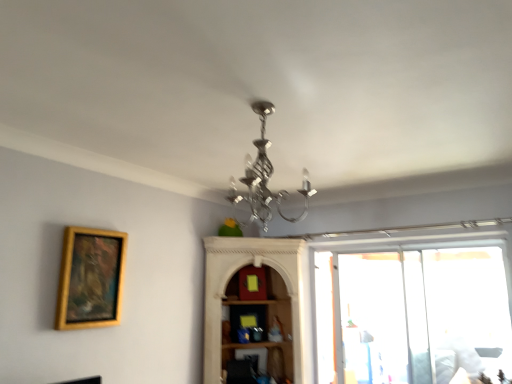
This screenshot has width=512, height=384. What do you see at coordinates (264, 178) in the screenshot?
I see `silver metallic chandelier at center` at bounding box center [264, 178].

In order to face silver metallic chandelier at center, should I rotate leftwards or rightwards?

Rotate right and turn 0.034 degrees.

What do you see at coordinates (90, 278) in the screenshot? The width and height of the screenshot is (512, 384). I see `gold wooden picture frame at left` at bounding box center [90, 278].

Identify the location of silver metallic chandelier at center. The image size is (512, 384). (264, 178).

Are transparent plastic screen door at right and silver metallic chandelier at center making contact?

No, transparent plastic screen door at right is not beside silver metallic chandelier at center.

Which is more to the right, transparent plastic screen door at right or silver metallic chandelier at center?

transparent plastic screen door at right is more to the right.

Is transparent plastic screen door at right facing towards silver metallic chandelier at center?

Yes, transparent plastic screen door at right is aimed at silver metallic chandelier at center.

Considering the sizes of gold wooden picture frame at left and transparent plastic screen door at right in the image, is gold wooden picture frame at left taller or shorter than transparent plastic screen door at right?

Clearly, gold wooden picture frame at left is shorter compared to transparent plastic screen door at right.

Is gold wooden picture frame at left turned away from transparent plastic screen door at right?

No, transparent plastic screen door at right is not at the back of gold wooden picture frame at left.

Would you say gold wooden picture frame at left is a long distance from transparent plastic screen door at right?

Yes, gold wooden picture frame at left and transparent plastic screen door at right are quite far apart.

Considering the sizes of silver metallic chandelier at center and transparent plastic screen door at right in the image, is silver metallic chandelier at center bigger or smaller than transparent plastic screen door at right?

In the image, silver metallic chandelier at center appears to be smaller than transparent plastic screen door at right.

Identify the location of screen door beneath the silver metallic chandelier at center (from a real-world perspective). (383, 318).

Based on the photo, from a real-world perspective, which object stands above the other?

From a 3D spatial view, silver metallic chandelier at center is above.

Between silver metallic chandelier at center and transparent plastic screen door at right, which one appears on the right side from the viewer's perspective?

From the viewer's perspective, transparent plastic screen door at right appears more on the right side.

Would you say silver metallic chandelier at center is outside gold wooden picture frame at left?

Yes, silver metallic chandelier at center is outside of gold wooden picture frame at left.

Does silver metallic chandelier at center come in front of gold wooden picture frame at left?

Yes, it is.

Are silver metallic chandelier at center and gold wooden picture frame at left making contact?

silver metallic chandelier at center and gold wooden picture frame at left are clearly separated.

Between silver metallic chandelier at center and gold wooden picture frame at left, which one has smaller size?

With smaller size is gold wooden picture frame at left.

Considering the relative sizes of gold wooden picture frame at left and silver metallic chandelier at center in the image provided, is gold wooden picture frame at left bigger than silver metallic chandelier at center?

No, gold wooden picture frame at left is not bigger than silver metallic chandelier at center.

Find the location of a particular element. light fixture located above the gold wooden picture frame at left (from the image's perspective) is located at coordinates (264, 178).

Is gold wooden picture frame at left not inside silver metallic chandelier at center?

Indeed, gold wooden picture frame at left is completely outside silver metallic chandelier at center.

Considering the positions of point (426, 355) and point (68, 281), is point (426, 355) closer or farther from the camera than point (68, 281)?

Point (426, 355) is positioned farther from the camera compared to point (68, 281).

Can you confirm if transparent plastic screen door at right is wider than gold wooden picture frame at left?

Indeed, transparent plastic screen door at right has a greater width compared to gold wooden picture frame at left.

Which object is positioned more to the right, transparent plastic screen door at right or gold wooden picture frame at left?

From the viewer's perspective, transparent plastic screen door at right appears more on the right side.

From a real-world perspective, is transparent plastic screen door at right positioned above or below gold wooden picture frame at left?

transparent plastic screen door at right is below gold wooden picture frame at left.

The width and height of the screenshot is (512, 384). Identify the location of light fixture above the transparent plastic screen door at right (from the image's perspective). (264, 178).

Where is `screen door below the gold wooden picture frame at left (from the image's perspective)`? The width and height of the screenshot is (512, 384). screen door below the gold wooden picture frame at left (from the image's perspective) is located at coordinates (383, 318).

Which object lies further to the anchor point gold wooden picture frame at left, silver metallic chandelier at center or transparent plastic screen door at right?

Based on the image, transparent plastic screen door at right appears to be further to gold wooden picture frame at left.

When comparing their distances from silver metallic chandelier at center, does gold wooden picture frame at left or transparent plastic screen door at right seem further?

transparent plastic screen door at right lies further to silver metallic chandelier at center than the other object.

From the image, which object appears to be nearer to transparent plastic screen door at right, silver metallic chandelier at center or gold wooden picture frame at left?

silver metallic chandelier at center lies closer to transparent plastic screen door at right than the other object.

When comparing their distances from gold wooden picture frame at left, does transparent plastic screen door at right or silver metallic chandelier at center seem further?

transparent plastic screen door at right lies further to gold wooden picture frame at left than the other object.

Estimate the real-world distances between objects in this image. Which object is closer to transparent plastic screen door at right, gold wooden picture frame at left or silver metallic chandelier at center?

silver metallic chandelier at center lies closer to transparent plastic screen door at right than the other object.

Estimate the real-world distances between objects in this image. Which object is closer to silver metallic chandelier at center, transparent plastic screen door at right or gold wooden picture frame at left?

gold wooden picture frame at left lies closer to silver metallic chandelier at center than the other object.

At what (x,y) coordinates should I click in order to perform the action: click on light fixture between gold wooden picture frame at left and transparent plastic screen door at right from left to right. Please return your answer as a coordinate pair (x, y). Looking at the image, I should click on (264, 178).